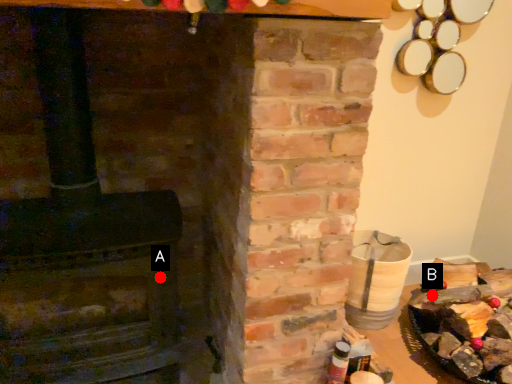
Question: Two points are circled on the image, labeled by A and B beside each circle. Which point is farther to the camera?

Choices:
 (A) A is further
 (B) B is further

Answer: (B)